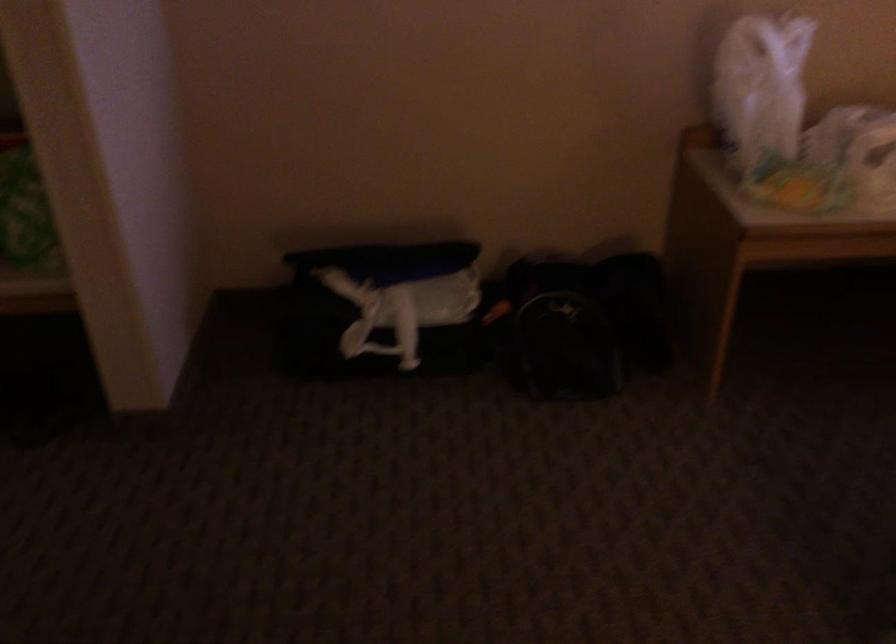
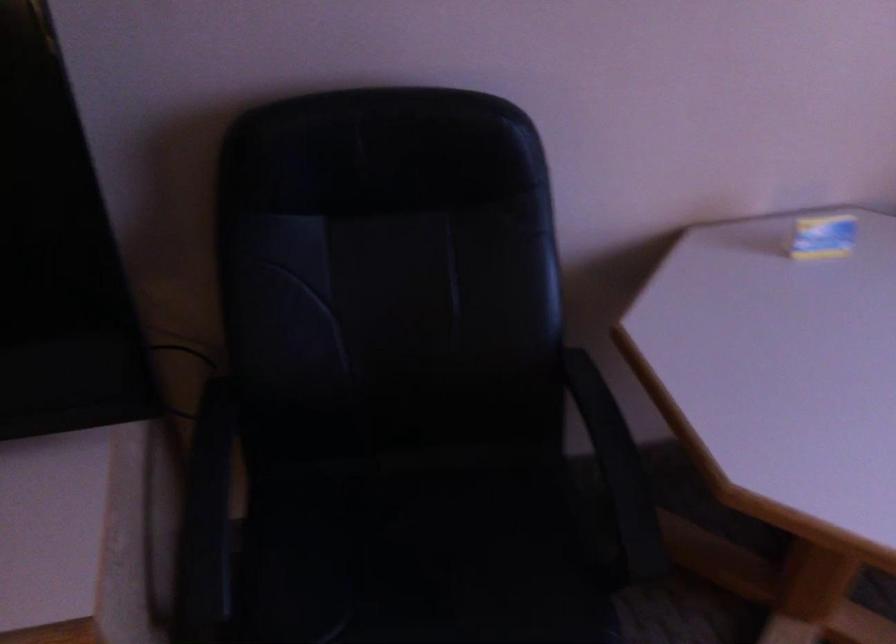
Question: What movement of the cameraman would produce the second image?

Choices:
 (A) Left
 (B) Right
 (C) Forward
 (D) Backward

Answer: (B)